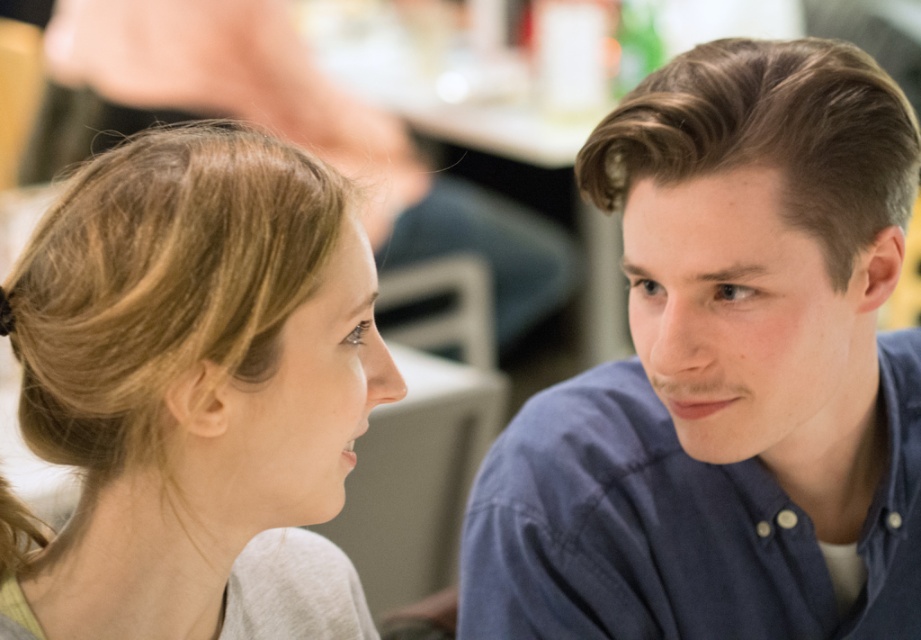
Who is lower down, blue cotton shirt at right or blonde hair at left?

blonde hair at left is lower down.

Can you confirm if blue cotton shirt at right is smaller than blonde hair at left?

No.

Locate an element on the screen. The width and height of the screenshot is (921, 640). blue cotton shirt at right is located at coordinates (725, 372).

This screenshot has height=640, width=921. In order to click on blue cotton shirt at right in this screenshot , I will do `click(725, 372)`.